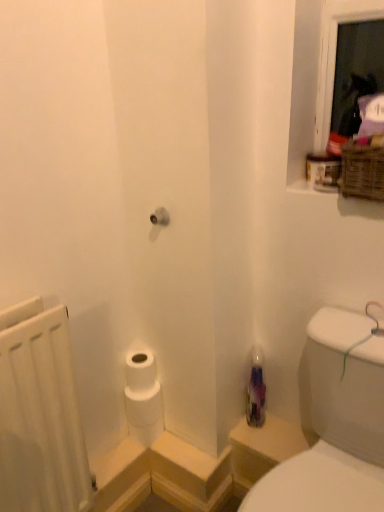
Question: Is translucent purple bottle at lower right not inside white matte radiator at left?

Choices:
 (A) yes
 (B) no

Answer: (A)

Question: Is there a large distance between translucent purple bottle at lower right and white matte radiator at left?

Choices:
 (A) no
 (B) yes

Answer: (A)

Question: Considering the relative sizes of translucent purple bottle at lower right and white matte radiator at left in the image provided, is translucent purple bottle at lower right wider than white matte radiator at left?

Choices:
 (A) yes
 (B) no

Answer: (B)

Question: From the image's perspective, is translucent purple bottle at lower right located above white matte radiator at left?

Choices:
 (A) no
 (B) yes

Answer: (B)

Question: Is translucent purple bottle at lower right in contact with white matte radiator at left?

Choices:
 (A) yes
 (B) no

Answer: (B)

Question: From a real-world perspective, is translucent purple bottle at lower right below white matte radiator at left?

Choices:
 (A) yes
 (B) no

Answer: (A)

Question: Would you say transparent plastic bottle at lower right is outside white matte toilet paper at lower left?

Choices:
 (A) yes
 (B) no

Answer: (A)

Question: From a real-world perspective, is transparent plastic bottle at lower right physically below white matte toilet paper at lower left?

Choices:
 (A) yes
 (B) no

Answer: (B)

Question: Is transparent plastic bottle at lower right oriented towards white matte toilet paper at lower left?

Choices:
 (A) no
 (B) yes

Answer: (A)

Question: Is the position of transparent plastic bottle at lower right less distant than that of white matte toilet paper at lower left?

Choices:
 (A) no
 (B) yes

Answer: (B)

Question: Is transparent plastic bottle at lower right oriented away from white matte toilet paper at lower left?

Choices:
 (A) yes
 (B) no

Answer: (B)

Question: Can you confirm if transparent plastic bottle at lower right is wider than white matte toilet paper at lower left?

Choices:
 (A) yes
 (B) no

Answer: (A)

Question: Is translucent purple bottle at lower right aimed at woven brown basket at upper right?

Choices:
 (A) yes
 (B) no

Answer: (B)